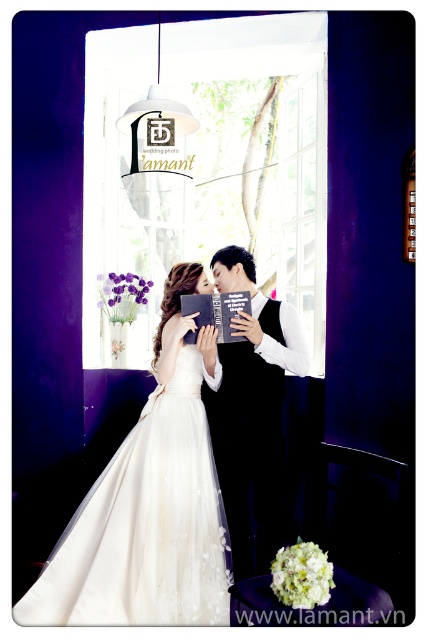
Between white satin dress at center and black satin suit at center, which one is positioned higher?

black satin suit at center is higher up.

Between white satin dress at center and black satin suit at center, which one has more height?

Standing taller between the two is black satin suit at center.

Where is `white satin dress at center`? This screenshot has height=640, width=426. white satin dress at center is located at coordinates (149, 500).